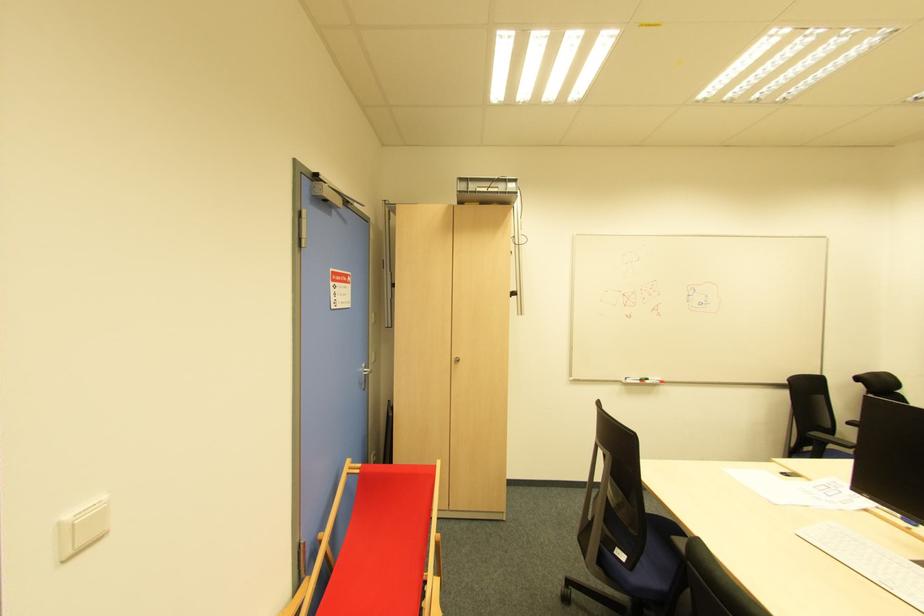
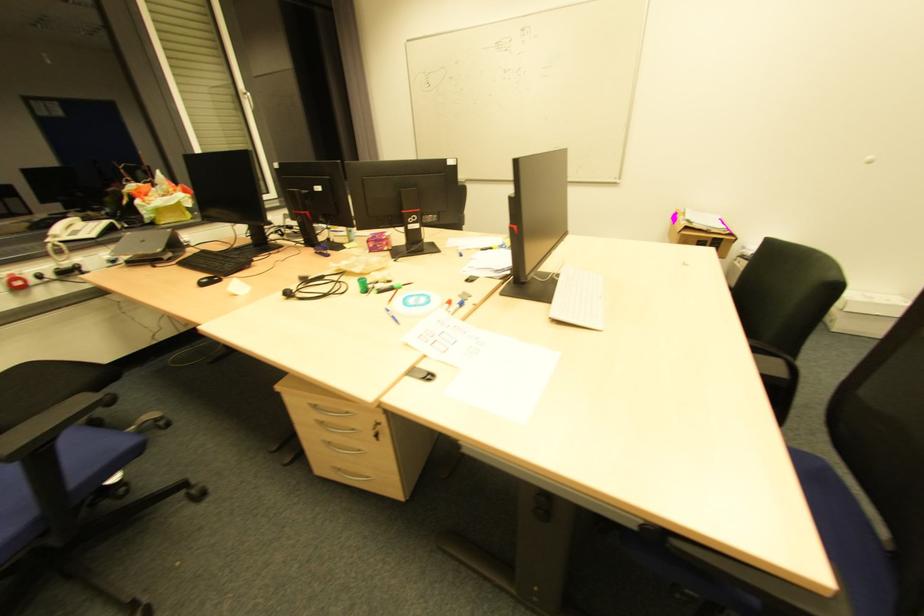
Question: I am providing you with two images of the same scene from different viewpoints. Which of the following objects are not visible in image2?

Choices:
 (A) red power button
 (B) black chair armrest
 (C) blue chair sitting surface
 (D) red spring toy

Answer: (C)